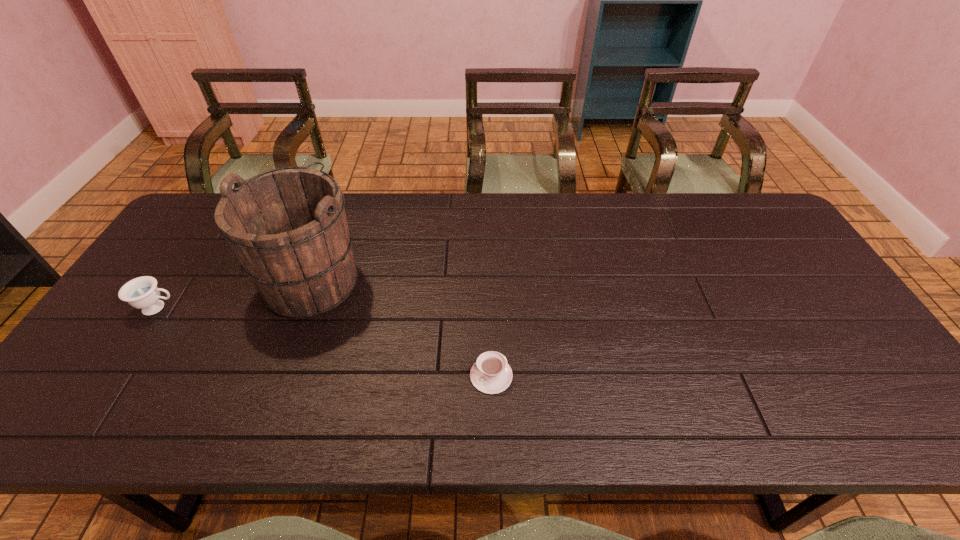
Identify the location of bucket. The height and width of the screenshot is (540, 960). (287, 226).

You are a GUI agent. You are given a task and a screenshot of the screen. Output one action in this format:
    pyautogui.click(x=<x>, y=<y>)
    Task: Click on the tallest object
    
    Given the screenshot: What is the action you would take?
    pyautogui.click(x=287, y=226)

I want to click on the leftmost object, so click(142, 293).

The height and width of the screenshot is (540, 960). I want to click on the left teacup, so click(x=142, y=293).

Where is `the rightmost object`? The height and width of the screenshot is (540, 960). the rightmost object is located at coordinates (491, 374).

The image size is (960, 540). I want to click on the nearest object, so click(x=491, y=374).

Identify the location of free space located 0.210m on the front of the tallest object. This screenshot has height=540, width=960. (270, 398).

At what (x,y) coordinates should I click in order to perform the action: click on free space located on the side of the second shortest object with the handle. Please return your answer as a coordinate pair (x, y). Image resolution: width=960 pixels, height=540 pixels. Looking at the image, I should click on (203, 308).

Locate an element on the screen. The width and height of the screenshot is (960, 540). free space located on the handle side of the nearer teacup is located at coordinates (372, 376).

This screenshot has height=540, width=960. I want to click on free location located on the handle side of the nearer teacup, so click(375, 376).